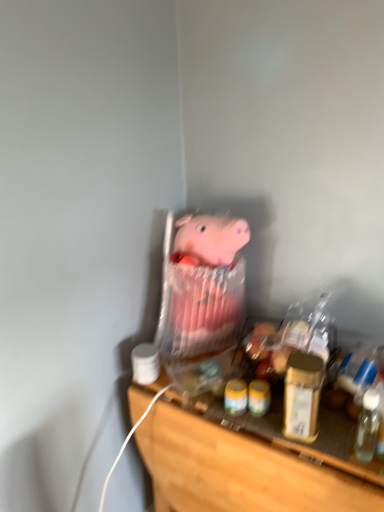
Question: Is wooden shelf at lower center smaller than gold metallic jar at right?

Choices:
 (A) no
 (B) yes

Answer: (A)

Question: Is gold metallic jar at right at the back of wooden shelf at lower center?

Choices:
 (A) yes
 (B) no

Answer: (B)

Question: Considering the relative positions of wooden shelf at lower center and gold metallic jar at right in the image provided, is wooden shelf at lower center to the right of gold metallic jar at right from the viewer's perspective?

Choices:
 (A) no
 (B) yes

Answer: (A)

Question: From the image's perspective, is wooden shelf at lower center below gold metallic jar at right?

Choices:
 (A) no
 (B) yes

Answer: (B)

Question: Is gold metallic jar at right located within wooden shelf at lower center?

Choices:
 (A) yes
 (B) no

Answer: (B)

Question: Considering the positions of pink fabric pig at center and wooden shelf at lower center in the image, is pink fabric pig at center bigger or smaller than wooden shelf at lower center?

Choices:
 (A) small
 (B) big

Answer: (A)

Question: Does point (231, 317) appear closer or farther from the camera than point (190, 415)?

Choices:
 (A) farther
 (B) closer

Answer: (A)

Question: From the image's perspective, is pink fabric pig at center above or below wooden shelf at lower center?

Choices:
 (A) above
 (B) below

Answer: (A)

Question: Visually, is pink fabric pig at center positioned to the left or to the right of wooden shelf at lower center?

Choices:
 (A) left
 (B) right

Answer: (A)

Question: Based on their sizes in the image, would you say wooden shelf at lower center is bigger or smaller than gold metallic jar at right?

Choices:
 (A) small
 (B) big

Answer: (B)

Question: Considering the positions of wooden shelf at lower center and gold metallic jar at right in the image, is wooden shelf at lower center wider or thinner than gold metallic jar at right?

Choices:
 (A) wide
 (B) thin

Answer: (A)

Question: From a real-world perspective, is wooden shelf at lower center physically located above or below gold metallic jar at right?

Choices:
 (A) below
 (B) above

Answer: (A)

Question: From the image's perspective, relative to gold metallic jar at right, is wooden shelf at lower center above or below?

Choices:
 (A) above
 (B) below

Answer: (B)

Question: Considering the relative positions of gold metallic jar at right and pink fabric pig at center in the image provided, is gold metallic jar at right to the left or to the right of pink fabric pig at center?

Choices:
 (A) left
 (B) right

Answer: (B)

Question: In terms of height, does gold metallic jar at right look taller or shorter compared to pink fabric pig at center?

Choices:
 (A) tall
 (B) short

Answer: (B)